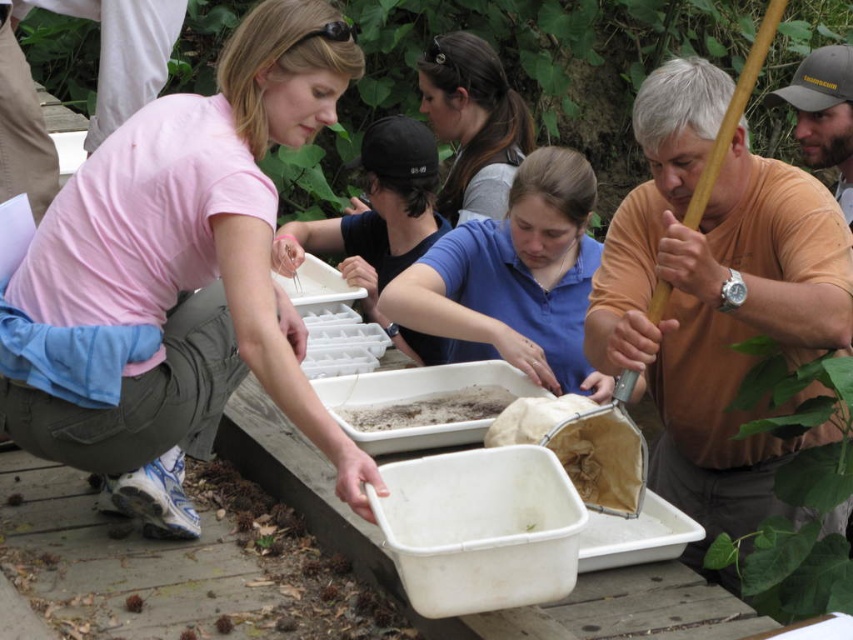
Question: Which object is farther from the camera taking this photo?

Choices:
 (A) blue matte shirt at center
 (B) green leafy plant at right
 (C) dark brown textured soil at center
 (D) smooth brown hair at center

Answer: (D)

Question: In this image, where is smooth brown hair at center located relative to dark brown textured soil at center?

Choices:
 (A) left
 (B) right

Answer: (B)

Question: Is blue matte shirt at center above green leafy plant at right?

Choices:
 (A) yes
 (B) no

Answer: (A)

Question: Which point is closer to the camera?

Choices:
 (A) (453, 394)
 (B) (764, 364)
 (C) (496, 333)

Answer: (B)

Question: Estimate the real-world distances between objects in this image. Which object is farther from the dark brown textured soil at center?

Choices:
 (A) blue matte shirt at center
 (B) green leafy plant at right
 (C) smooth brown hair at center

Answer: (C)

Question: Does smooth brown hair at center have a lesser width compared to dark brown textured soil at center?

Choices:
 (A) no
 (B) yes

Answer: (B)